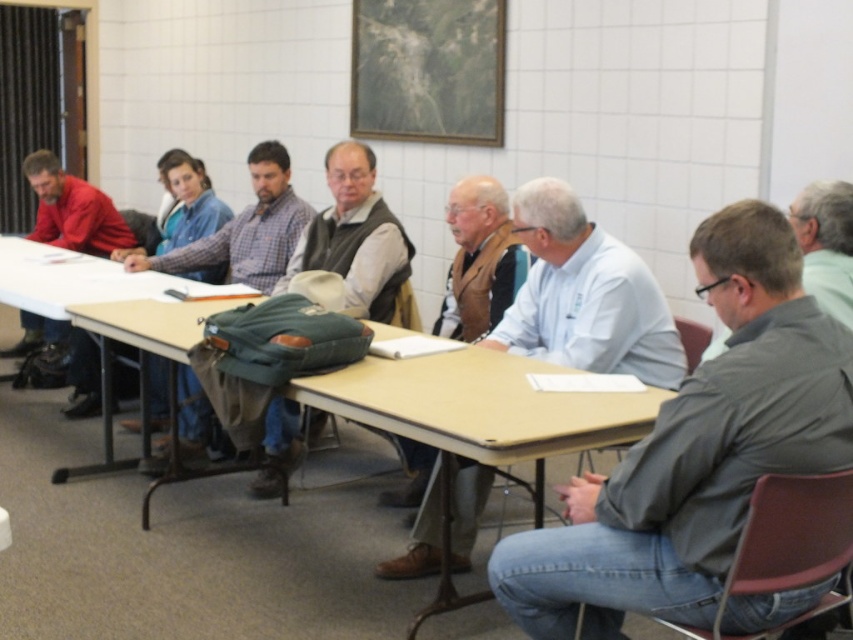
Question: Considering the real-world distances, which object is closest to the green fabric backpack at center?

Choices:
 (A) matte green backpack at center
 (B) green fabric jacket at center

Answer: (B)

Question: Which point is closer to the camera taking this photo?

Choices:
 (A) coord(166,333)
 (B) coord(509,244)
 (C) coord(83,237)

Answer: (A)

Question: Can you confirm if gray matte shirt at center is thinner than matte green backpack at center?

Choices:
 (A) yes
 (B) no

Answer: (A)

Question: Among these objects, which one is nearest to the camera?

Choices:
 (A) light blue shirt at center
 (B) green fabric backpack at center
 (C) brown leather vest at center

Answer: (A)

Question: Can you confirm if matte red shirt at left is positioned below gray matte shirt at right?

Choices:
 (A) no
 (B) yes

Answer: (B)

Question: From the image, what is the correct spatial relationship of matte red shirt at left in relation to gray matte shirt at right?

Choices:
 (A) below
 (B) above

Answer: (A)